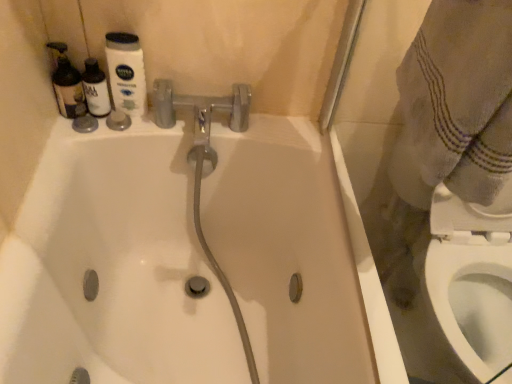
Identify the location of white plastic bidet at lower right. (472, 303).

The height and width of the screenshot is (384, 512). Describe the element at coordinates (472, 303) in the screenshot. I see `white plastic bidet at lower right` at that location.

Identify the location of white glossy bathtub at center. (113, 267).

Describe the element at coordinates (113, 267) in the screenshot. The width and height of the screenshot is (512, 384). I see `white glossy bathtub at center` at that location.

Identify the location of white plastic bidet at lower right. This screenshot has height=384, width=512. (472, 303).

Consider the image. Based on their positions, is white plastic bidet at lower right located to the left or right of white glossy bathtub at center?

Based on their positions, white plastic bidet at lower right is located to the right of white glossy bathtub at center.

Which is in front, white plastic bidet at lower right or white glossy bathtub at center?

white glossy bathtub at center is more forward.

Which is farther, (x=502, y=325) or (x=322, y=257)?

The point (x=502, y=325) is farther.

From the image's perspective, relative to white glossy bathtub at center, is white plastic bidet at lower right above or below?

white plastic bidet at lower right is situated lower than white glossy bathtub at center in the image.

From a real-world perspective, who is located higher, white plastic bidet at lower right or white glossy bathtub at center?

white glossy bathtub at center, from a real-world perspective.

Is white plastic bidet at lower right thinner than white glossy bathtub at center?

Correct, the width of white plastic bidet at lower right is less than that of white glossy bathtub at center.

From their relative heights in the image, would you say white plastic bidet at lower right is taller or shorter than white glossy bathtub at center?

Clearly, white plastic bidet at lower right is shorter compared to white glossy bathtub at center.

Is white plastic bidet at lower right smaller than white glossy bathtub at center?

Yes, white plastic bidet at lower right is smaller than white glossy bathtub at center.

Is white glossy bathtub at center located within white plastic bidet at lower right?

No.

Based on the photo, is white plastic bidet at lower right far from white glossy bathtub at center?

No.

Is white glossy bathtub at center at the back of white plastic bidet at lower right?

That's not correct — white plastic bidet at lower right is not looking away from white glossy bathtub at center.

Can you tell me how much white plastic bidet at lower right and white glossy bathtub at center differ in facing direction?

1.22 degrees separate the facing orientations of white plastic bidet at lower right and white glossy bathtub at center.

Where is `bathtub located above the white plastic bidet at lower right (from the image's perspective)`? The image size is (512, 384). bathtub located above the white plastic bidet at lower right (from the image's perspective) is located at coordinates (113, 267).

Which is more to the left, white glossy bathtub at center or white plastic bidet at lower right?

Positioned to the left is white glossy bathtub at center.

Is white glossy bathtub at center in front of white plastic bidet at lower right?

Yes, the depth of white glossy bathtub at center is less than that of white plastic bidet at lower right.

Between point (160, 348) and point (488, 379), which one is positioned behind?

The point (160, 348) is farther.

From the image's perspective, is white glossy bathtub at center beneath white plastic bidet at lower right?

No.

From a real-world perspective, relative to white plastic bidet at lower right, is white glossy bathtub at center vertically above or below?

white glossy bathtub at center is above white plastic bidet at lower right.

Considering the relative sizes of white glossy bathtub at center and white plastic bidet at lower right in the image provided, is white glossy bathtub at center wider than white plastic bidet at lower right?

Correct, the width of white glossy bathtub at center exceeds that of white plastic bidet at lower right.

Considering the relative sizes of white glossy bathtub at center and white plastic bidet at lower right in the image provided, is white glossy bathtub at center taller than white plastic bidet at lower right?

Correct, white glossy bathtub at center is much taller as white plastic bidet at lower right.

Who is bigger, white glossy bathtub at center or white plastic bidet at lower right?

white glossy bathtub at center.

Which is correct: white glossy bathtub at center is inside white plastic bidet at lower right, or outside of it?

white glossy bathtub at center is located beyond the bounds of white plastic bidet at lower right.

Is white glossy bathtub at center not near white plastic bidet at lower right?

Actually, white glossy bathtub at center and white plastic bidet at lower right are a little close together.

Is white glossy bathtub at center positioned with its back to white plastic bidet at lower right?

No.

From the picture: Can you tell me how much white glossy bathtub at center and white plastic bidet at lower right differ in facing direction?

white glossy bathtub at center and white plastic bidet at lower right are facing 1.22 degrees away from each other.

Find the location of a particular element. Image resolution: width=512 pixels, height=384 pixels. bidet behind the white glossy bathtub at center is located at coordinates (472, 303).

This screenshot has width=512, height=384. Identify the location of bathtub above the white plastic bidet at lower right (from a real-world perspective). (113, 267).

The image size is (512, 384). I want to click on bathtub that is on the left side of white plastic bidet at lower right, so click(x=113, y=267).